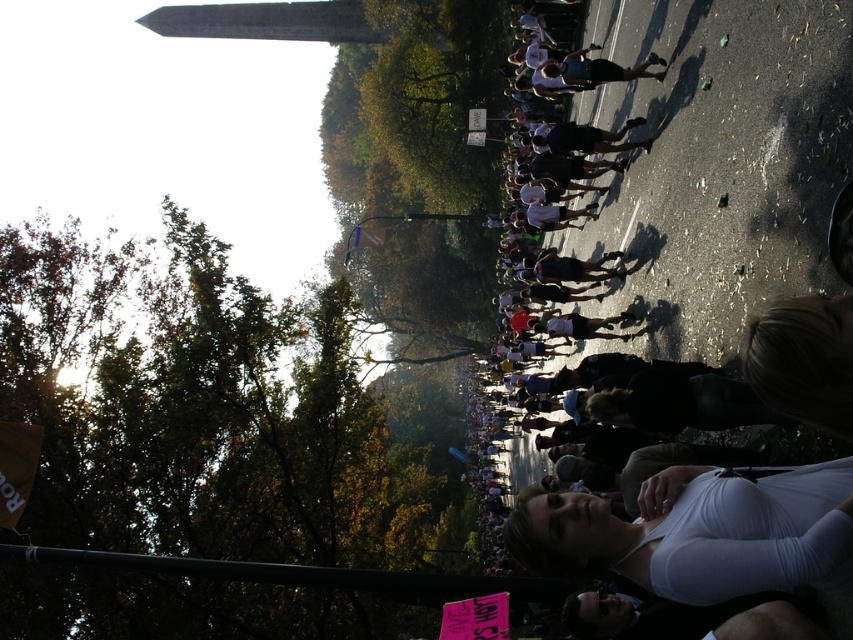
Does point (567, 362) lie behind point (834, 572)?

Yes, it is.

Which is above, dark clothing at center or white matte shirt at lower right?

dark clothing at center is higher up.

The height and width of the screenshot is (640, 853). Describe the element at coordinates (718, 163) in the screenshot. I see `dark clothing at center` at that location.

Find the location of a particular element. dark clothing at center is located at coordinates (718, 163).